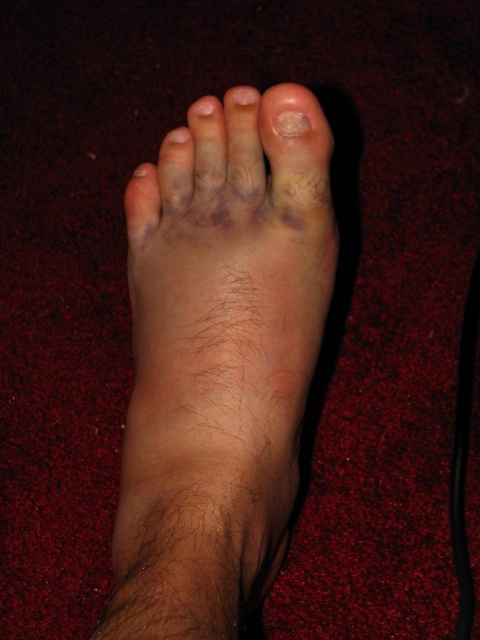
Question: Can you confirm if dry skin foot at center is thinner than pale skin toe at upper center?

Choices:
 (A) no
 (B) yes

Answer: (A)

Question: Can you confirm if dry skin foot at center is positioned to the right of pale skin toe at upper center?

Choices:
 (A) no
 (B) yes

Answer: (A)

Question: In this image, where is dry skin foot at center located relative to pale skin toe at upper center?

Choices:
 (A) left
 (B) right

Answer: (A)